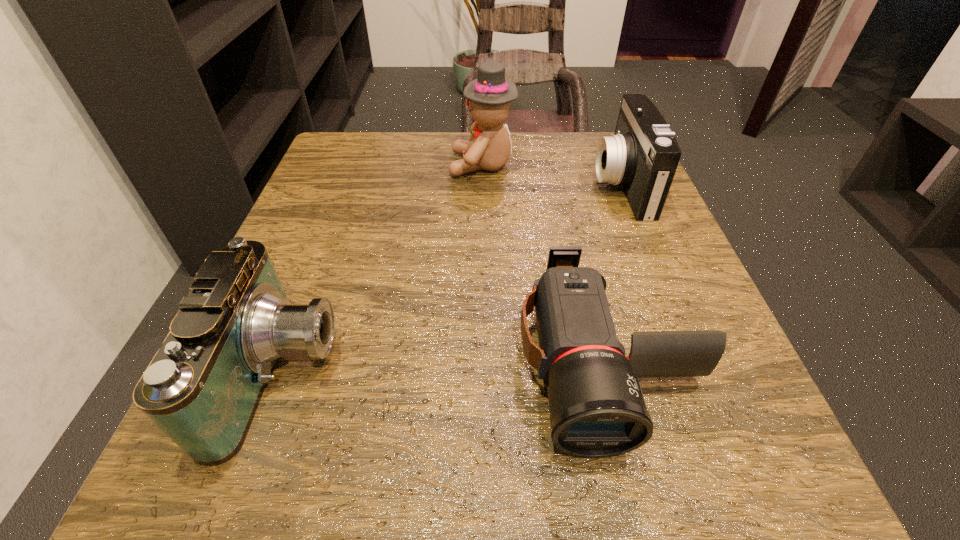
Locate an element on the screen. The width and height of the screenshot is (960, 540). the tallest object is located at coordinates (488, 97).

Image resolution: width=960 pixels, height=540 pixels. Identify the location of the farthest camcorder. (643, 154).

Identify the location of the leftmost camcorder. This screenshot has width=960, height=540. (202, 388).

Image resolution: width=960 pixels, height=540 pixels. Identify the location of the shortest camcorder. (597, 409).

The width and height of the screenshot is (960, 540). Identify the location of vacant space positioned 0.150m on the front-facing side of the tallest object. [x=382, y=165].

Find the location of a particular element. The width and height of the screenshot is (960, 540). vacant space located 0.160m on the front-facing side of the tallest object is located at coordinates (377, 165).

The width and height of the screenshot is (960, 540). In order to click on vacant space situated on the front-facing side of the tallest object in this screenshot , I will do `click(427, 165)`.

The height and width of the screenshot is (540, 960). I want to click on vacant space located on the lens of the farthest camcorder, so click(x=494, y=185).

The image size is (960, 540). Find the location of `vacant point located 0.220m on the lens of the farthest camcorder`. vacant point located 0.220m on the lens of the farthest camcorder is located at coordinates (490, 185).

Locate an element on the screen. The height and width of the screenshot is (540, 960). vacant area located on the lens of the farthest camcorder is located at coordinates (407, 185).